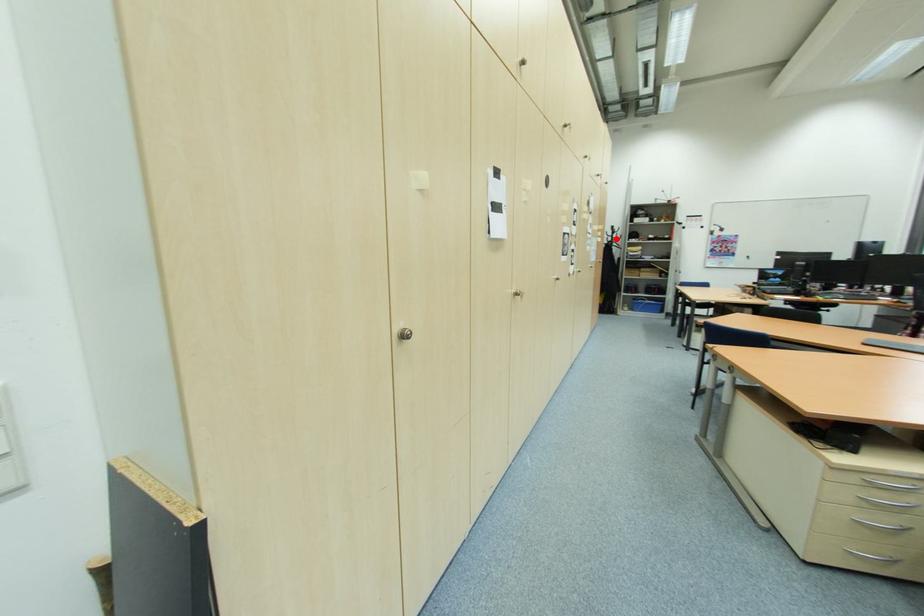
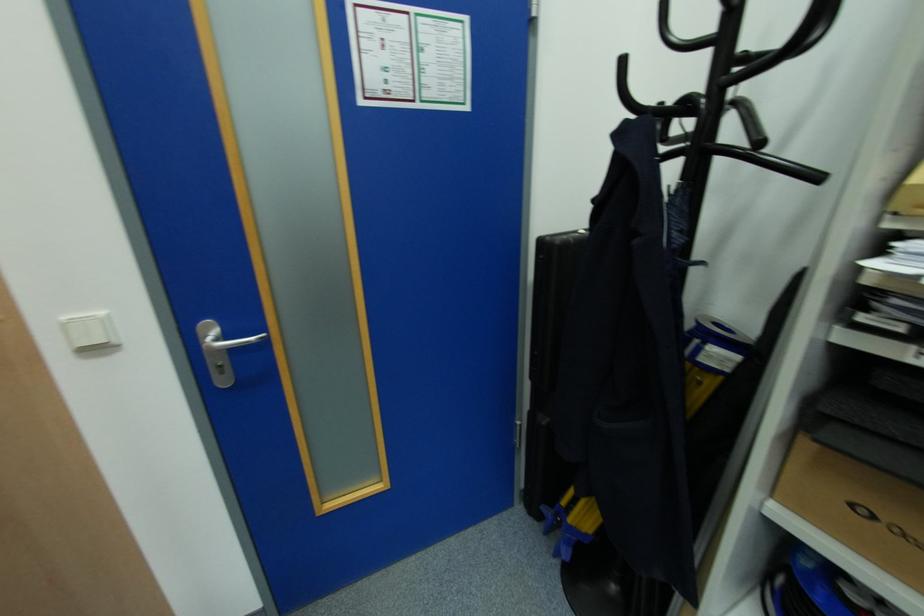
The point at the highlighted location is marked in the first image. Where is the corresponding point in the second image?

(726, 61)